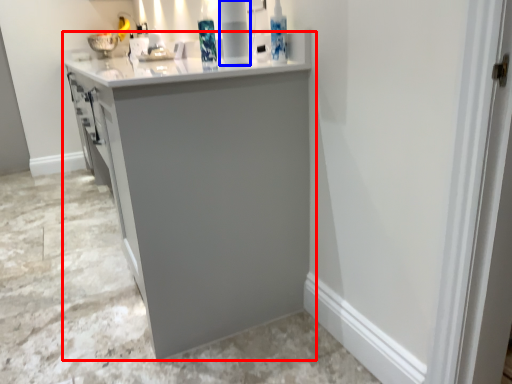
Question: Which point is further to the camera, cabinetry (highlighted by a red box) or appliance (highlighted by a blue box)?

Choices:
 (A) cabinetry
 (B) appliance

Answer: (B)